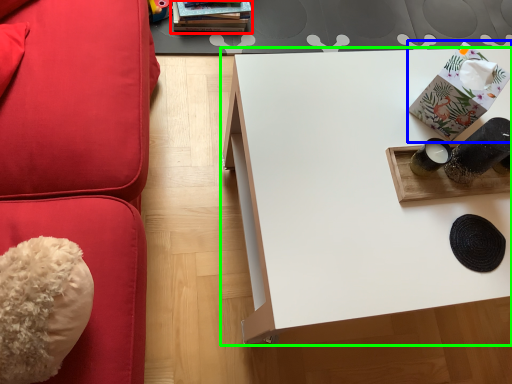
Question: Which object is the farthest from book (highlighted by a red box)? Choose among these: package (highlighted by a blue box) or table (highlighted by a green box).

Choices:
 (A) package
 (B) table

Answer: (A)